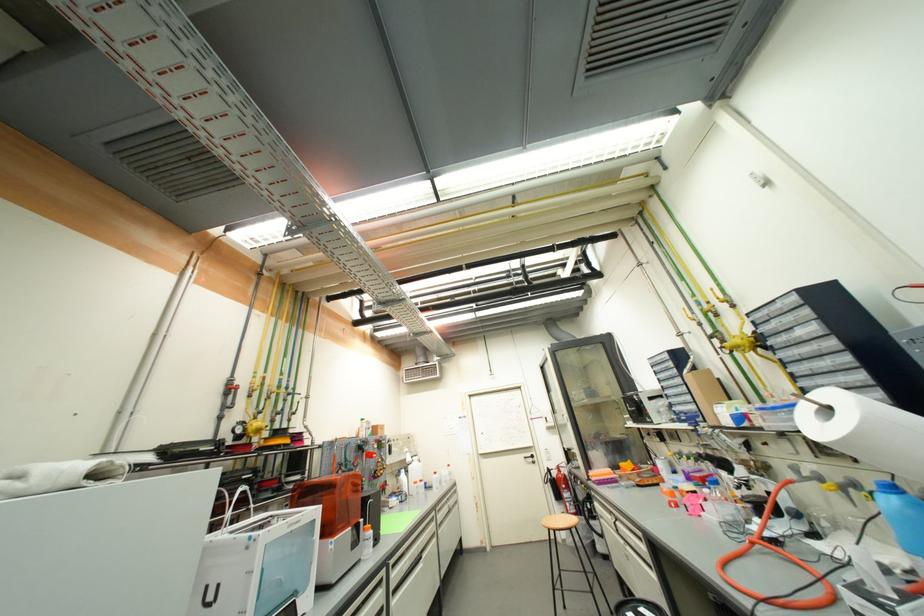
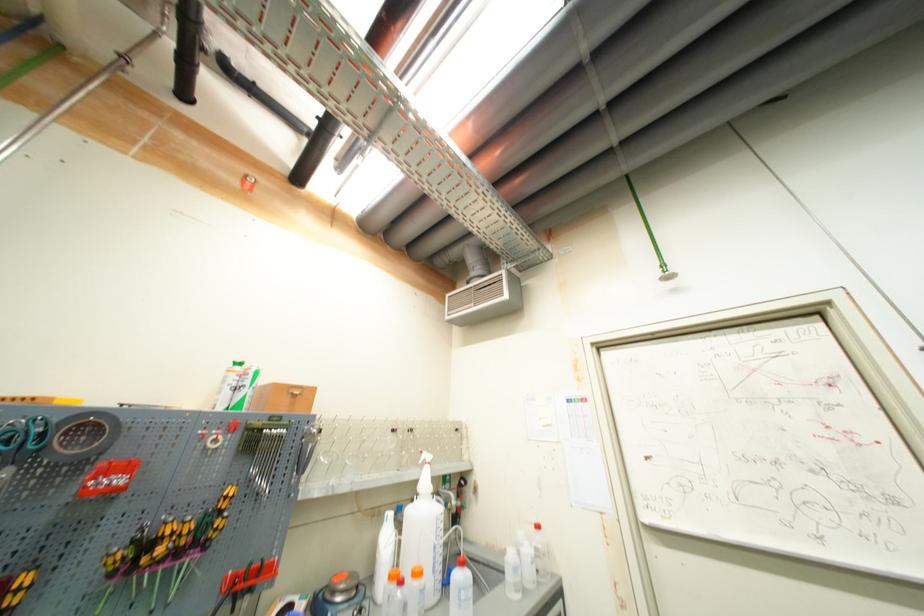
Where in the second image is the point corresponding to (x=370, y=480) from the first image?

(30, 581)